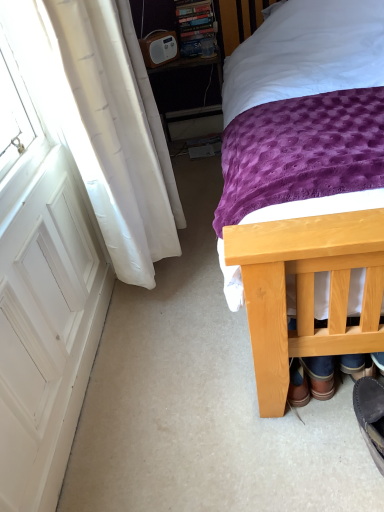
Question: Is dark grey suede shoe at lower right, placed as the 1th footwear when sorted from right to left, at the left side of white plastic radio at upper center?

Choices:
 (A) yes
 (B) no

Answer: (B)

Question: Would you say white plastic radio at upper center is part of dark grey suede shoe at lower right, the 2th footwear positioned from the left,'s contents?

Choices:
 (A) yes
 (B) no

Answer: (B)

Question: From the image's perspective, does dark grey suede shoe at lower right, placed as the 1th footwear when sorted from right to left, appear lower than white plastic radio at upper center?

Choices:
 (A) no
 (B) yes

Answer: (B)

Question: Does dark grey suede shoe at lower right, the 2th footwear viewed from the back, have a larger size compared to white plastic radio at upper center?

Choices:
 (A) no
 (B) yes

Answer: (A)

Question: Is dark grey suede shoe at lower right, the 2th footwear positioned from the left, shorter than white plastic radio at upper center?

Choices:
 (A) no
 (B) yes

Answer: (B)

Question: From a real-world perspective, is dark grey suede shoe at lower right, the 2th footwear viewed from the back, on top of white plastic radio at upper center?

Choices:
 (A) yes
 (B) no

Answer: (B)

Question: Is white matte screen door at left at the right side of brown leather boots at lower right, arranged as the 2th footwear when viewed from the right?

Choices:
 (A) no
 (B) yes

Answer: (A)

Question: Could you tell me if white matte screen door at left is facing brown leather boots at lower right, arranged as the 2th footwear when viewed from the right?

Choices:
 (A) no
 (B) yes

Answer: (B)

Question: Does white matte screen door at left touch brown leather boots at lower right, which ranks as the second footwear in front-to-back order?

Choices:
 (A) no
 (B) yes

Answer: (A)

Question: From the image's perspective, is white matte screen door at left under brown leather boots at lower right, which ranks as the second footwear in front-to-back order?

Choices:
 (A) yes
 (B) no

Answer: (B)

Question: Is brown leather boots at lower right, marked as the first footwear in a left-to-right arrangement, inside white matte screen door at left?

Choices:
 (A) yes
 (B) no

Answer: (B)

Question: Does white matte screen door at left have a smaller size compared to brown leather boots at lower right, marked as the first footwear in a left-to-right arrangement?

Choices:
 (A) no
 (B) yes

Answer: (A)

Question: Are white matte screen door at left and wooden bed at center beside each other?

Choices:
 (A) no
 (B) yes

Answer: (A)